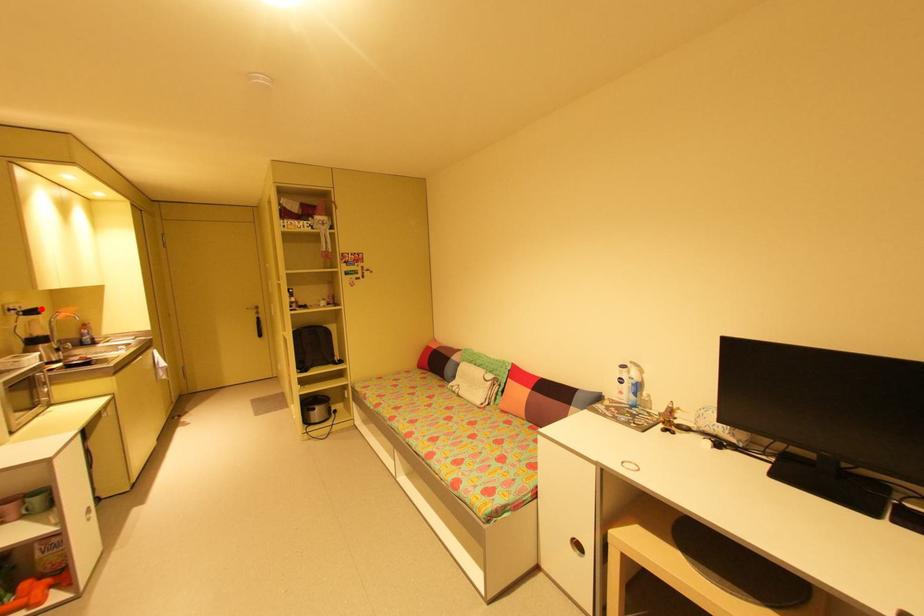
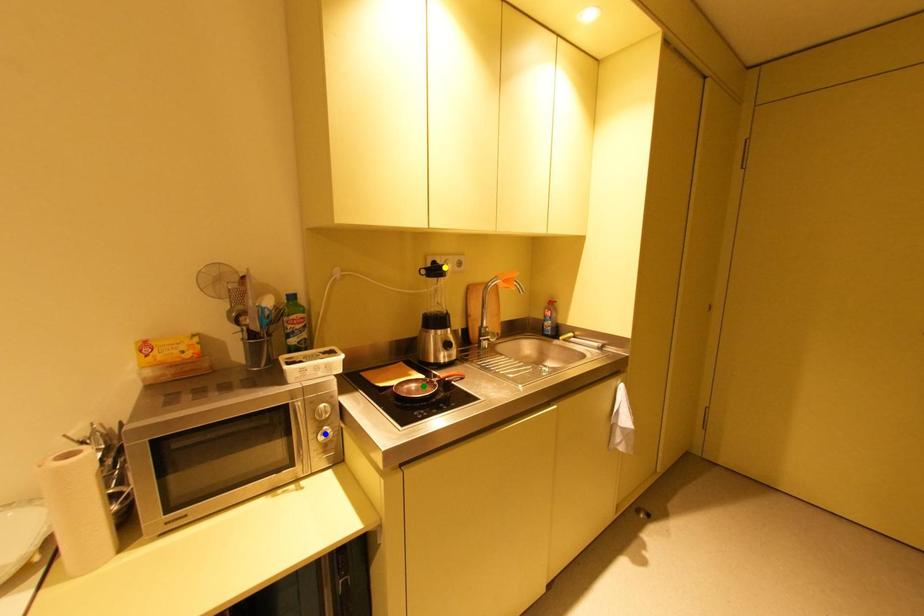
Question: I am providing you with two images of the same scene from different viewpoints. A red point is marked on the first image. You are given multiple points on the second image. Which spot in image 2 lines up with the point in image 1?

Choices:
 (A) yellow point
 (B) green point
 (C) blue point

Answer: (A)